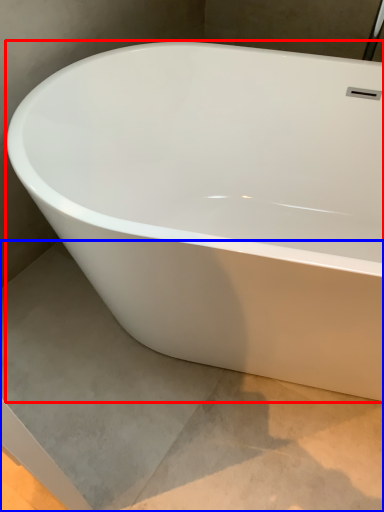
Question: Among these objects, which one is farthest to the camera, bathtub (highlighted by a red box) or concrete (highlighted by a blue box)?

Choices:
 (A) bathtub
 (B) concrete

Answer: (B)